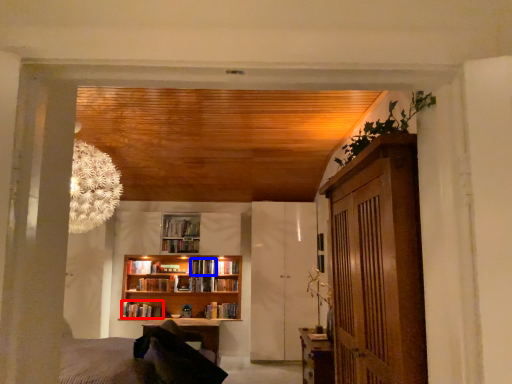
Question: Which point is further to the camera, book (highlighted by a red box) or book (highlighted by a blue box)?

Choices:
 (A) book
 (B) book

Answer: (B)